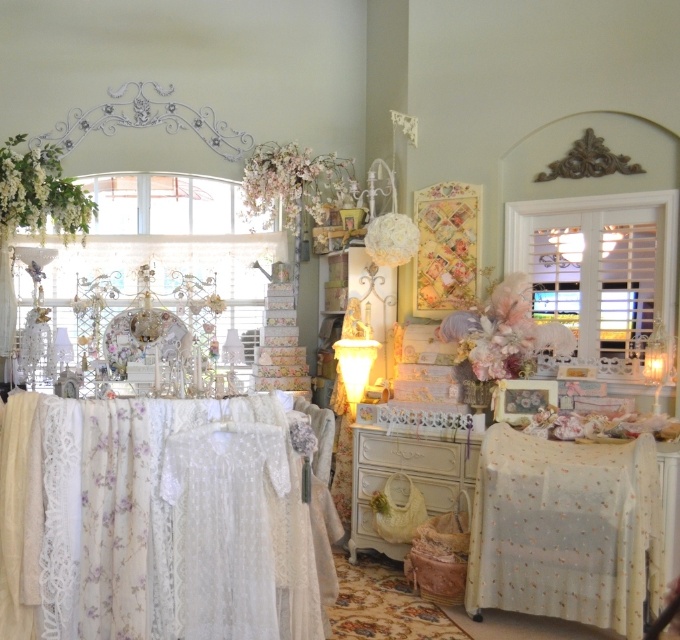
Looking at this image, you are a customer in this vintage shop and want to place a small bouquet of flowers on the table. Which tablecloth should you choose if you want the bouquet to be more visible from the entrance? The options are the white lace tablecloth at lower left and the light beige lace tablecloth at lower right.

The white lace tablecloth at lower left is in front of the light beige lace tablecloth at lower right, so placing the bouquet on the white lace tablecloth at lower left would make it more visible from the entrance since it is closer to the viewer.

You are a customer in this vintage shop and want to place a small bouquet between the white lace tablecloth at lower left and the light beige lace tablecloth at lower right. Can you fit the bouquet if it requires 1 meter of space?

The distance between the white lace tablecloth at lower left and the light beige lace tablecloth at lower right is 1.54 meters, which is more than enough to place the bouquet requiring 1 meter of space.

You are setting up a table for a special event and need to choose between the white lace tablecloth at lower left and the light beige lace tablecloth at lower right. Based on their sizes, which one would you recommend if you want a tablecloth that covers more of the table surface?

The light beige lace tablecloth at lower right occupies more space than the white lace tablecloth at lower left, so it would be the better choice for covering a larger area of the table surface.